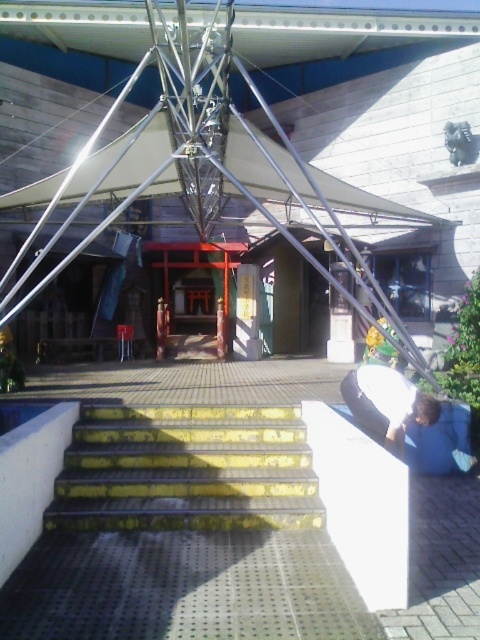
Can you confirm if yellow painted concrete stairs at center is shorter than blue fabric shirt at lower right?

Indeed, yellow painted concrete stairs at center has a lesser height compared to blue fabric shirt at lower right.

Who is shorter, yellow painted concrete stairs at center or blue fabric shirt at lower right?

Standing shorter between the two is yellow painted concrete stairs at center.

Is point (218, 419) closer to camera compared to point (376, 387)?

That is False.

What are the coordinates of `yellow painted concrete stairs at center` in the screenshot? It's located at [x=186, y=470].